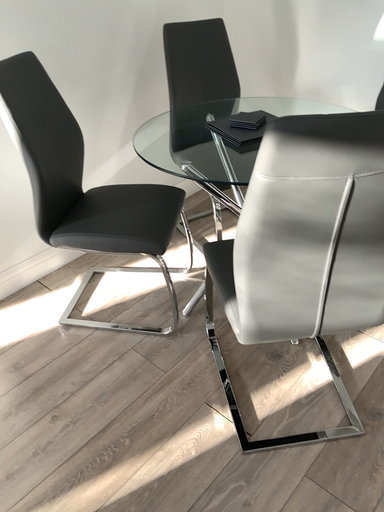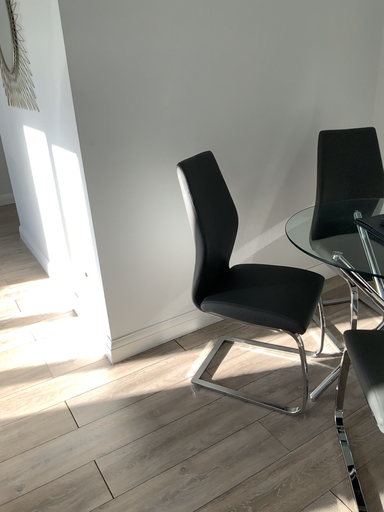
Question: Which way did the camera rotate in the video?

Choices:
 (A) rotated downward
 (B) rotated upward

Answer: (B)